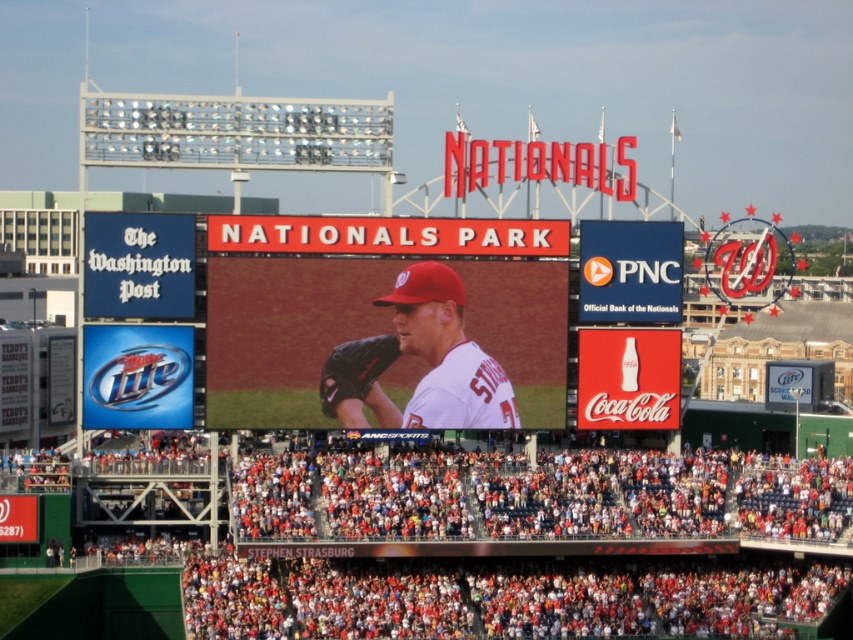
Does white matte baseball uniform at center appear on the left side of black leather glove at center?

No, white matte baseball uniform at center is not to the left of black leather glove at center.

From the picture: Is white matte baseball uniform at center positioned behind black leather glove at center?

No.

Where is `white matte baseball uniform at center`? white matte baseball uniform at center is located at coordinates (424, 358).

Is white matte scoreboard at center to the left of black leather glove at center from the viewer's perspective?

In fact, white matte scoreboard at center is to the right of black leather glove at center.

Does point (372, 326) come closer to viewer compared to point (341, 378)?

No, (372, 326) is behind (341, 378).

Between point (541, 300) and point (347, 380), which one is positioned behind?

The point (541, 300) is behind.

You are a GUI agent. You are given a task and a screenshot of the screen. Output one action in this format:
    pyautogui.click(x=<x>, y=<y>)
    Task: Click on the white matte scoreboard at center
    This screenshot has height=640, width=853.
    Given the screenshot: What is the action you would take?
    pyautogui.click(x=386, y=342)

Who is more distant from viewer, (225,388) or (492,422)?

Point (492,422)

Which is in front, point (270, 339) or point (428, 388)?

Positioned in front is point (270, 339).

Where is `white matte scoreboard at center`? The width and height of the screenshot is (853, 640). white matte scoreboard at center is located at coordinates (386, 342).